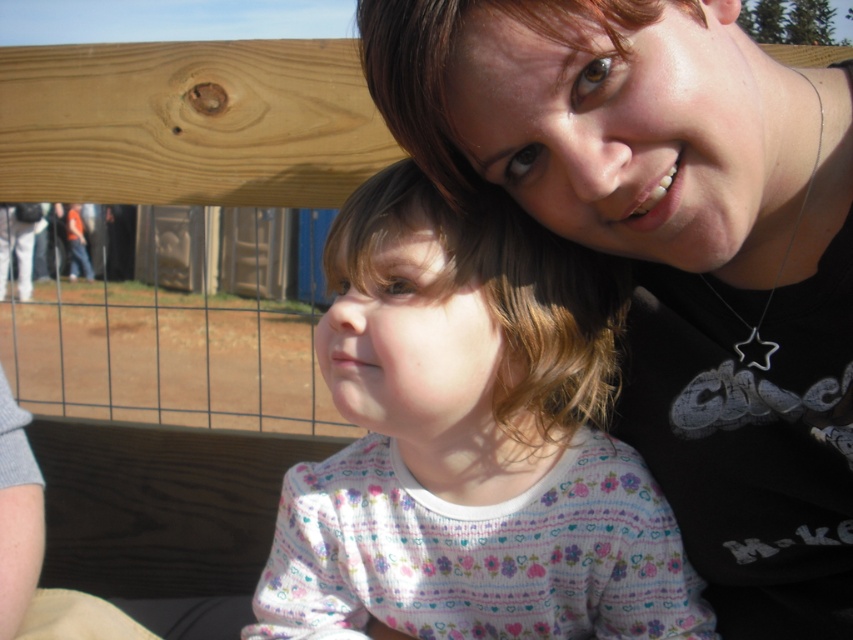
Question: Which object is farther from the camera taking this photo?

Choices:
 (A) matte black shirt at upper right
 (B) floral-patterned sweater at center

Answer: (B)

Question: In this image, where is matte black shirt at upper right located relative to floral-patterned sweater at center?

Choices:
 (A) above
 (B) below

Answer: (A)

Question: Among these points, which one is nearest to the camera?

Choices:
 (A) (426, 232)
 (B) (711, 65)

Answer: (B)

Question: Is matte black shirt at upper right positioned in front of floral-patterned sweater at center?

Choices:
 (A) yes
 (B) no

Answer: (A)

Question: Is matte black shirt at upper right smaller than floral-patterned sweater at center?

Choices:
 (A) no
 (B) yes

Answer: (A)